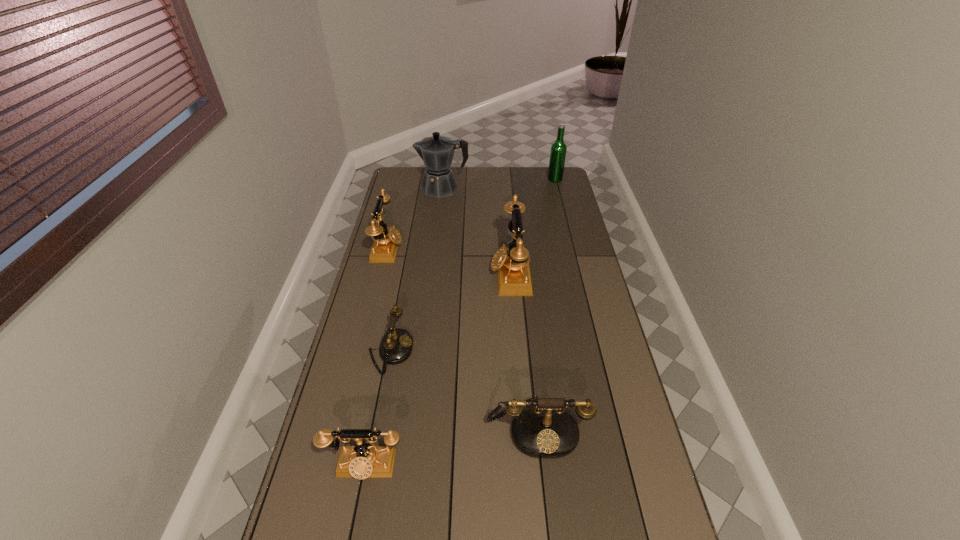
This screenshot has width=960, height=540. In order to click on vacant space at the right edge of the desktop in this screenshot , I will do `click(566, 235)`.

Where is `vacant area that lies between the fourth tallest object and the rightmost beige telephone`? The image size is (960, 540). vacant area that lies between the fourth tallest object and the rightmost beige telephone is located at coordinates (449, 261).

Where is `free spot between the smallest beige telephone and the beer bottle`? The width and height of the screenshot is (960, 540). free spot between the smallest beige telephone and the beer bottle is located at coordinates (460, 322).

At what (x,y) coordinates should I click in order to perform the action: click on unoccupied position between the bigger black telephone and the fourth shortest object. Please return your answer as a coordinate pair (x, y). The width and height of the screenshot is (960, 540). Looking at the image, I should click on (463, 338).

At what (x,y) coordinates should I click in order to perform the action: click on vacant space that's between the fifth farthest object and the fourth tallest object. Please return your answer as a coordinate pair (x, y). The image size is (960, 540). Looking at the image, I should click on (389, 300).

The width and height of the screenshot is (960, 540). I want to click on free area in between the second smallest beige telephone and the biggest beige telephone, so click(x=449, y=261).

I want to click on object that is the closest to the bigger black telephone, so click(361, 461).

Select which object is the closest to the second biggest beige telephone. Please provide its 2D coordinates. Your answer should be formatted as a tuple, i.e. [(x, y)], where the tuple contains the x and y coordinates of a point satisfying the conditions above.

[(437, 152)]

Identify which telephone is located as the second nearest to the beer bottle. Please provide its 2D coordinates. Your answer should be formatted as a tuple, i.e. [(x, y)], where the tuple contains the x and y coordinates of a point satisfying the conditions above.

[(386, 241)]

At what (x,y) coordinates should I click in order to perform the action: click on telephone that is the closest to the coffeepot. Please return your answer as a coordinate pair (x, y). The width and height of the screenshot is (960, 540). Looking at the image, I should click on (386, 241).